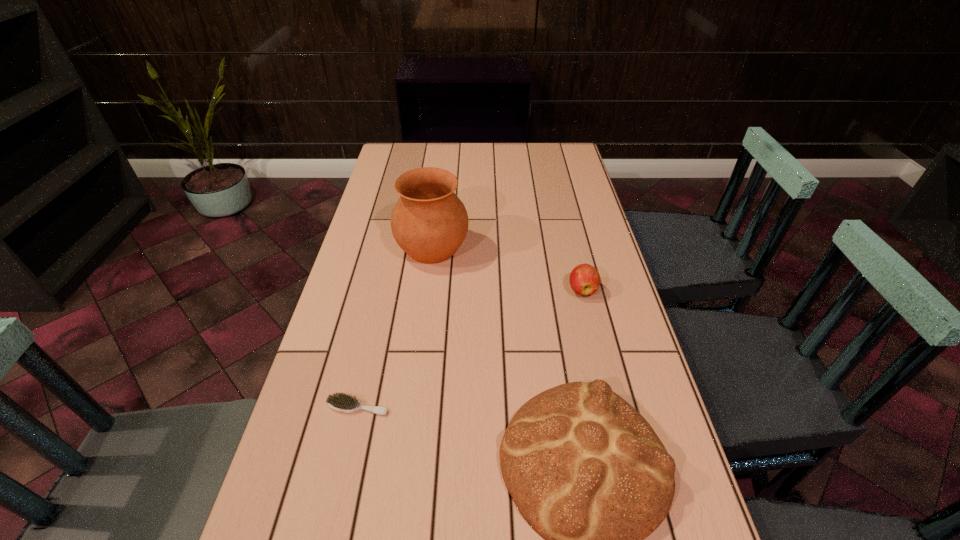
At what (x,y) coordinates should I click in order to perform the action: click on object located at the right edge. Please return your answer as a coordinate pair (x, y). Looking at the image, I should click on (584, 279).

In the image, there is a desktop. At what (x,y) coordinates should I click in order to perform the action: click on vacant space at the far edge. Please return your answer as a coordinate pair (x, y). This screenshot has height=540, width=960. Looking at the image, I should click on (443, 168).

Where is `free spot at the left edge of the desktop`? free spot at the left edge of the desktop is located at coordinates (389, 187).

In the image, there is a desktop. Where is `vacant area at the right edge`? Image resolution: width=960 pixels, height=540 pixels. vacant area at the right edge is located at coordinates (554, 214).

In the image, there is a desktop. Where is `free space at the far right corner`? The width and height of the screenshot is (960, 540). free space at the far right corner is located at coordinates (544, 146).

This screenshot has height=540, width=960. I want to click on vacant point located between the pottery and the apple, so click(x=507, y=269).

At what (x,y) coordinates should I click in order to perform the action: click on empty space between the scrubbing brush and the farthest object. Please return your answer as a coordinate pair (x, y). Looking at the image, I should click on (396, 327).

This screenshot has width=960, height=540. In order to click on object that ranks as the third closest to the apple in this screenshot , I will do `click(341, 402)`.

At what (x,y) coordinates should I click in order to perform the action: click on the second closest object to the tallest object. Please return your answer as a coordinate pair (x, y). Looking at the image, I should click on (588, 473).

Identify the location of free point that satisfies the following two spatial constraints: 1. on the back side of the shortest object; 2. on the right side of the tallest object. (395, 248).